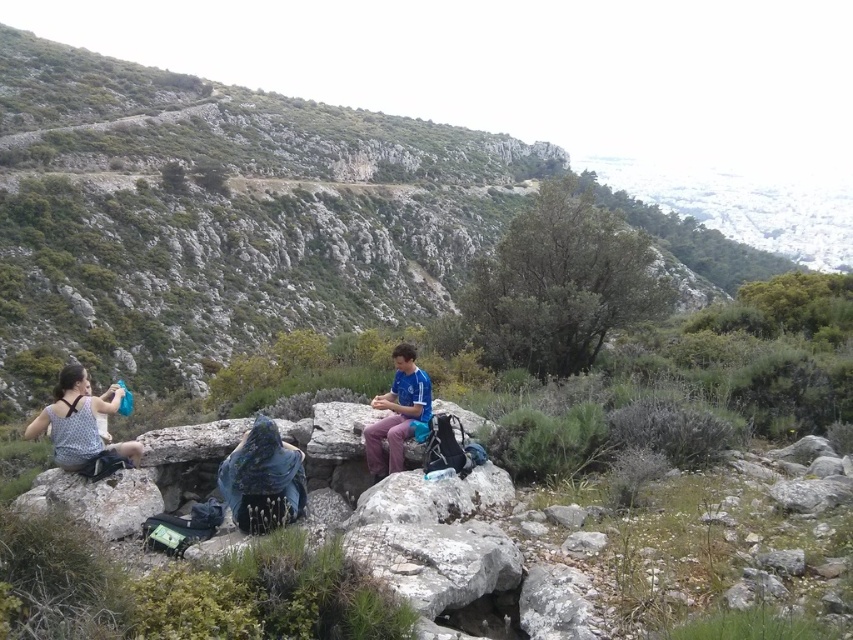
You are a hiker who just arrived at this rocky area. You need to locate your blue jersey at center and polka dot fabric backpack at lower left. Which object is closer to the ground?

The polka dot fabric backpack at lower left is positioned under the blue jersey at center, so it is closer to the ground.

You are planning to place a rectangular object between the polka dot fabric backpack at lower left and the blue jersey at center. The object is 1.2 meters long and 0.8 meters wide. Can you fit it horizontally between them without tilting it?

The polka dot fabric backpack at lower left might be wider than blue jersey at center, so the width between them could be sufficient to fit the 0.8 meters wide object horizontally. However, the exact placement depends on the actual width difference between the two items.